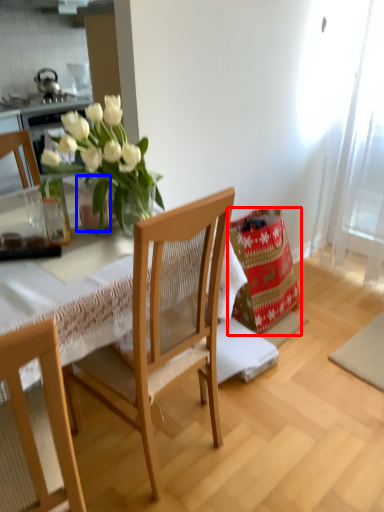
Question: Which object appears farthest to the camera in this image, material (highlighted by a red box) or vase (highlighted by a blue box)?

Choices:
 (A) material
 (B) vase

Answer: (A)